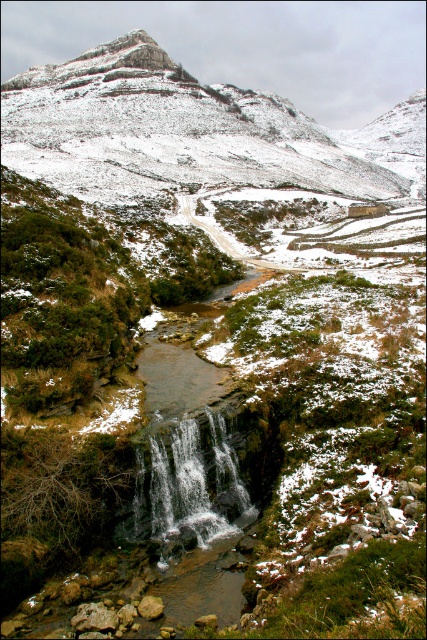
Question: Is snowy rocky mountain at center behind white frothy water at center?

Choices:
 (A) yes
 (B) no

Answer: (A)

Question: In this image, where is snowy rocky mountain at center located relative to white frothy water at center?

Choices:
 (A) right
 (B) left

Answer: (B)

Question: Which object is closer to the camera taking this photo?

Choices:
 (A) snowy rocky mountain at center
 (B) white frothy water at center

Answer: (B)

Question: Which of the following is the closest to the observer?

Choices:
 (A) snowy rocky mountain at center
 (B) white frothy water at center

Answer: (B)

Question: Which point appears farthest from the camera in this image?

Choices:
 (A) (53, 140)
 (B) (210, 435)

Answer: (A)

Question: Does snowy rocky mountain at center have a lesser width compared to white frothy water at center?

Choices:
 (A) no
 (B) yes

Answer: (A)